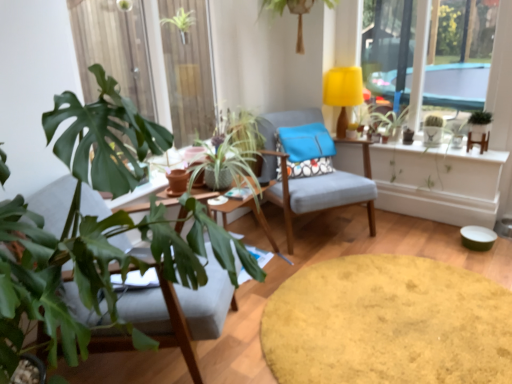
Locate an element on the screen. This screenshot has width=512, height=384. vacant area on top of velvet yellow rug at center, placed as the 2th round table when sorted from top to bottom (from a real-world perspective) is located at coordinates pyautogui.click(x=387, y=316).